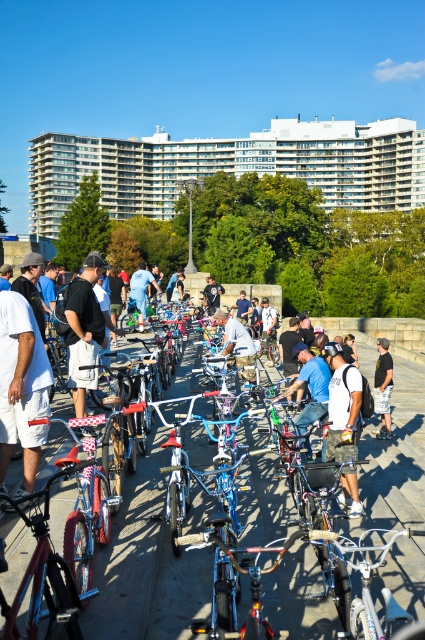
Can you confirm if light brown shorts at center is smaller than denim shorts at center?

Yes.

Who is taller, light brown shorts at center or denim shorts at center?

denim shorts at center

Between point (390, 432) and point (138, 324), which one is positioned behind?

Point (138, 324)

Where is `light brown shorts at center`? light brown shorts at center is located at coordinates (382, 387).

Is matte black shirt at center above denim shorts at center?

No, matte black shirt at center is not above denim shorts at center.

Can you confirm if matte black shirt at center is wider than denim shorts at center?

In fact, matte black shirt at center might be narrower than denim shorts at center.

Measure the distance between point (71, 349) and camera.

They are 34.65 feet apart.

At what (x,y) coordinates should I click in order to perform the action: click on matte black shirt at center. Please return your answer as a coordinate pair (x, y). Image resolution: width=425 pixels, height=640 pixels. Looking at the image, I should click on (84, 330).

This screenshot has width=425, height=640. In order to click on blue metallic bicycle at center in this screenshot , I will do `click(309, 387)`.

Which is in front, point (319, 365) or point (135, 294)?

Point (319, 365) is more forward.

Image resolution: width=425 pixels, height=640 pixels. Find the location of `blue metallic bicycle at center`. blue metallic bicycle at center is located at coordinates (309, 387).